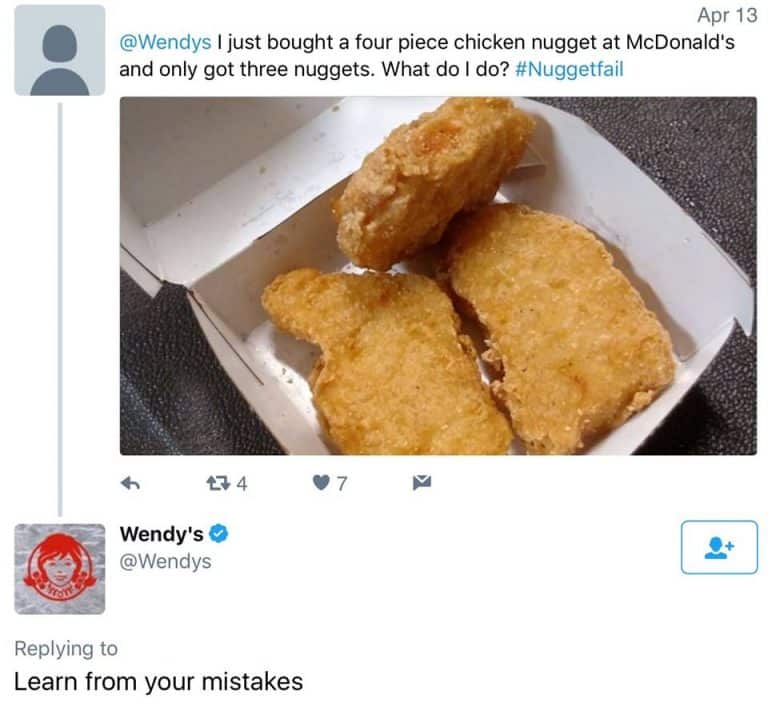
The image size is (768, 711). Find the location of `box`. box is located at coordinates (253, 166).